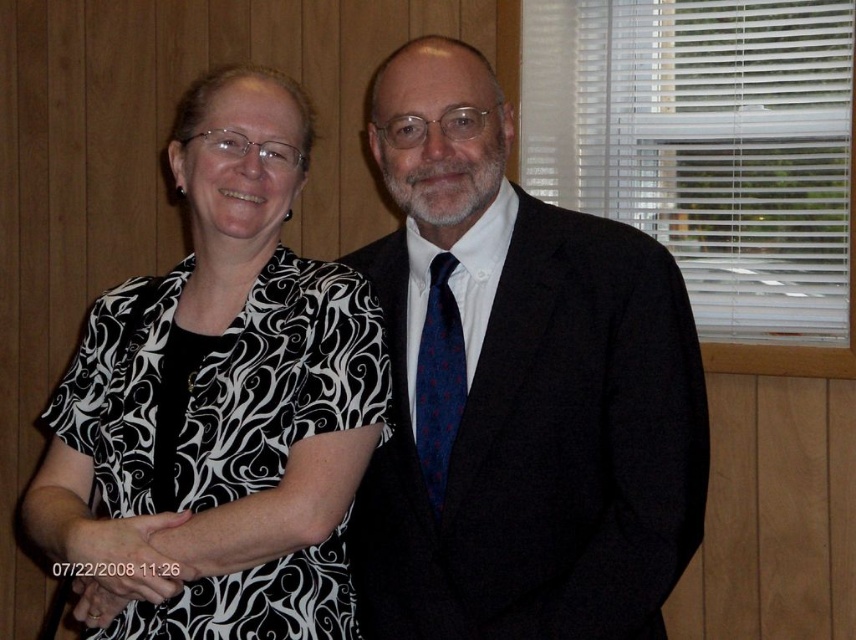
You are standing in the room and see the two people. There is a point at coordinates (218, 404). Which person is this point located on?

The point at coordinates (218, 404) is located on the black and white printed blouse at left, which belongs to the woman on the left.

You are taking a photo of two people in a room with a camera that can only focus on objects at a certain distance. The two points in the image are important for focusing. Which point, point (x=640, y=572) or point (x=428, y=371), is closer to the camera and thus should be focused on to ensure clarity?

Point (x=640, y=572) is closer to the camera than point (x=428, y=371), so focusing on it will ensure clarity.